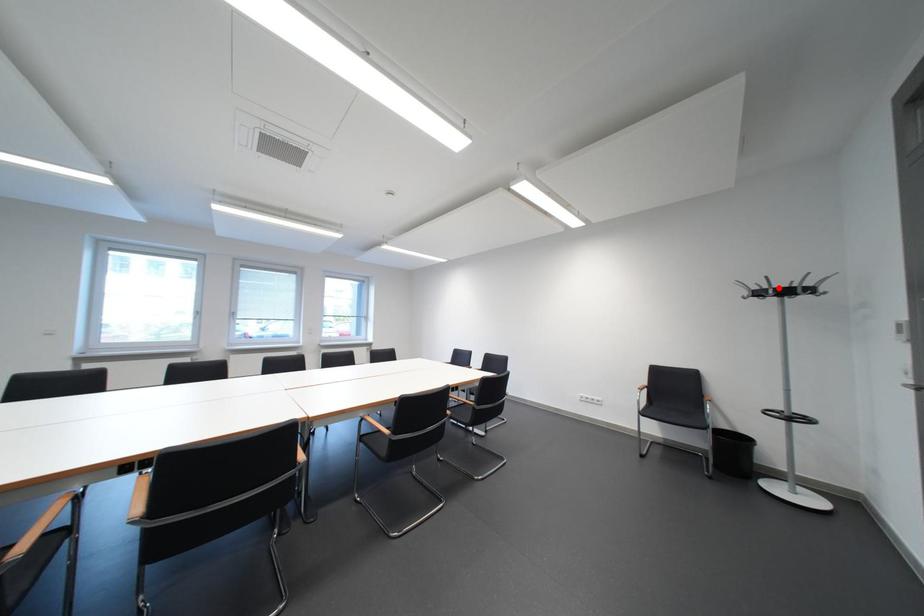
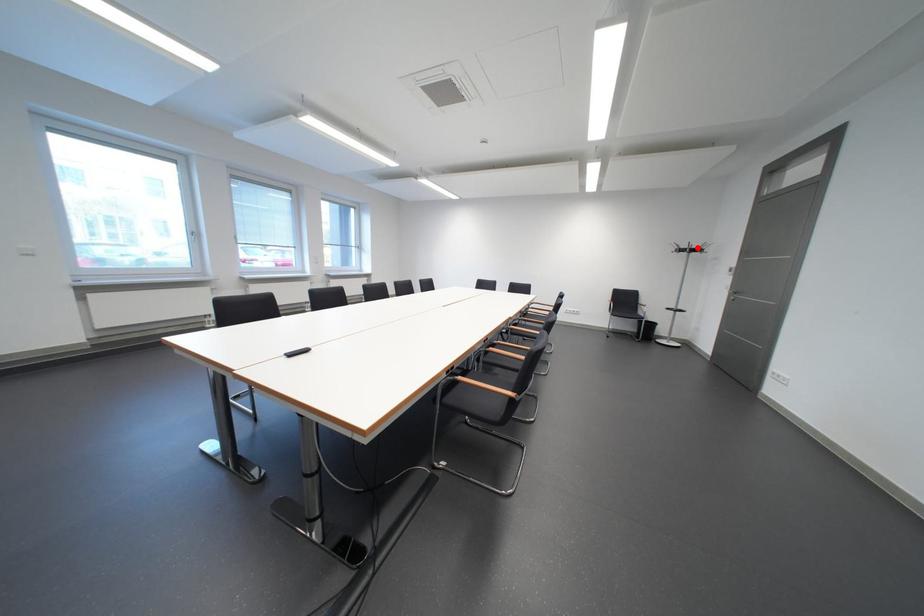
I am providing you with two images of the same scene from different viewpoints. A red point is marked on the first image and another point is marked on the second image. Are the points marked in image1 and image2 representing the same 3D position?

Yes